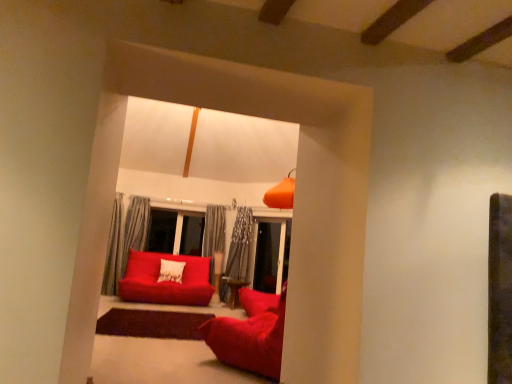
Image resolution: width=512 pixels, height=384 pixels. What do you see at coordinates (166, 281) in the screenshot?
I see `matte red studio couch at center, which appears as the 1th studio couch when viewed from the left` at bounding box center [166, 281].

This screenshot has width=512, height=384. I want to click on matte red studio couch at center, placed as the 2th studio couch when sorted from right to left, so [166, 281].

This screenshot has width=512, height=384. Describe the element at coordinates (250, 334) in the screenshot. I see `velvet red beanbag at center, acting as the first studio couch starting from the front` at that location.

This screenshot has width=512, height=384. What are the coordinates of `velvet red beanbag at center, which ranks as the 2th studio couch in left-to-right order` in the screenshot? It's located at (250, 334).

I want to click on matte red studio couch at center, arranged as the first studio couch when viewed from the back, so click(166, 281).

Is velvet red beanbag at center, acting as the first studio couch starting from the front, to the left or to the right of matte red studio couch at center, placed as the 2th studio couch when sorted from right to left, in the image?

Based on their positions, velvet red beanbag at center, acting as the first studio couch starting from the front, is located to the right of matte red studio couch at center, placed as the 2th studio couch when sorted from right to left.

Considering the positions of objects velvet red beanbag at center, acting as the first studio couch starting from the front, and matte red studio couch at center, the second studio couch viewed from the front, in the image provided, who is behind, velvet red beanbag at center, acting as the first studio couch starting from the front, or matte red studio couch at center, the second studio couch viewed from the front,?

matte red studio couch at center, the second studio couch viewed from the front.

Which is less distant, (237, 341) or (199, 261)?

The point (237, 341) is closer.

Based on the photo, from the image's perspective, relative to matte red studio couch at center, placed as the 2th studio couch when sorted from right to left, is velvet red beanbag at center, arranged as the 1th studio couch when viewed from the right, above or below?

Clearly, from the image's perspective, velvet red beanbag at center, arranged as the 1th studio couch when viewed from the right, is above matte red studio couch at center, placed as the 2th studio couch when sorted from right to left.

From a real-world perspective, is velvet red beanbag at center, acting as the first studio couch starting from the front, over matte red studio couch at center, which appears as the 1th studio couch when viewed from the left?

Incorrect, from a real-world perspective, velvet red beanbag at center, acting as the first studio couch starting from the front, is lower than matte red studio couch at center, which appears as the 1th studio couch when viewed from the left.

Does velvet red beanbag at center, acting as the first studio couch starting from the front, have a lesser width compared to matte red studio couch at center, arranged as the first studio couch when viewed from the back?

Yes, velvet red beanbag at center, acting as the first studio couch starting from the front, is thinner than matte red studio couch at center, arranged as the first studio couch when viewed from the back.

Who is shorter, velvet red beanbag at center, arranged as the 1th studio couch when viewed from the right, or matte red studio couch at center, the second studio couch viewed from the front?

velvet red beanbag at center, arranged as the 1th studio couch when viewed from the right, is shorter.

Can you confirm if velvet red beanbag at center, arranged as the 1th studio couch when viewed from the right, is bigger than matte red studio couch at center, which appears as the 1th studio couch when viewed from the left?

No, velvet red beanbag at center, arranged as the 1th studio couch when viewed from the right, is not bigger than matte red studio couch at center, which appears as the 1th studio couch when viewed from the left.

Can we say velvet red beanbag at center, arranged as the 1th studio couch when viewed from the right, lies outside matte red studio couch at center, placed as the 2th studio couch when sorted from right to left?

That's correct, velvet red beanbag at center, arranged as the 1th studio couch when viewed from the right, is outside of matte red studio couch at center, placed as the 2th studio couch when sorted from right to left.

Is velvet red beanbag at center, acting as the first studio couch starting from the front, not close to matte red studio couch at center, which appears as the 1th studio couch when viewed from the left?

Absolutely, velvet red beanbag at center, acting as the first studio couch starting from the front, is distant from matte red studio couch at center, which appears as the 1th studio couch when viewed from the left.

Is velvet red beanbag at center, acting as the first studio couch starting from the front, turned away from matte red studio couch at center, arranged as the first studio couch when viewed from the back?

No, matte red studio couch at center, arranged as the first studio couch when viewed from the back, is not at the back of velvet red beanbag at center, acting as the first studio couch starting from the front.

You are a GUI agent. You are given a task and a screenshot of the screen. Output one action in this format:
    pyautogui.click(x=<x>, y=<y>)
    Task: Click on the studio couch below the matte red studio couch at center, which appears as the 1th studio couch when viewed from the left (from a real-world perspective)
    This screenshot has width=512, height=384.
    Given the screenshot: What is the action you would take?
    pyautogui.click(x=250, y=334)

Which object is positioned more to the left, matte red studio couch at center, arranged as the first studio couch when viewed from the back, or velvet red beanbag at center, acting as the first studio couch starting from the front?

Positioned to the left is matte red studio couch at center, arranged as the first studio couch when viewed from the back.

Does matte red studio couch at center, arranged as the first studio couch when viewed from the back, lie in front of velvet red beanbag at center, arranged as the 2th studio couch when viewed from the back?

No, the depth of matte red studio couch at center, arranged as the first studio couch when viewed from the back, is greater than that of velvet red beanbag at center, arranged as the 2th studio couch when viewed from the back.

Which is closer, (x=163, y=288) or (x=264, y=349)?

The point (x=264, y=349) is closer to the camera.

From the image's perspective, would you say matte red studio couch at center, placed as the 2th studio couch when sorted from right to left, is shown under velvet red beanbag at center, which ranks as the 2th studio couch in left-to-right order?

Indeed, from the image's perspective, matte red studio couch at center, placed as the 2th studio couch when sorted from right to left, is shown beneath velvet red beanbag at center, which ranks as the 2th studio couch in left-to-right order.

From a real-world perspective, between matte red studio couch at center, placed as the 2th studio couch when sorted from right to left, and velvet red beanbag at center, which ranks as the 2th studio couch in left-to-right order, who is vertically higher?

matte red studio couch at center, placed as the 2th studio couch when sorted from right to left, is physically above.

Can you confirm if matte red studio couch at center, arranged as the first studio couch when viewed from the back, is thinner than velvet red beanbag at center, arranged as the 2th studio couch when viewed from the back?

No.

From the picture: In terms of height, does matte red studio couch at center, which appears as the 1th studio couch when viewed from the left, look taller or shorter compared to velvet red beanbag at center, acting as the first studio couch starting from the front?

Considering their sizes, matte red studio couch at center, which appears as the 1th studio couch when viewed from the left, has more height than velvet red beanbag at center, acting as the first studio couch starting from the front.

In terms of size, does matte red studio couch at center, which appears as the 1th studio couch when viewed from the left, appear bigger or smaller than velvet red beanbag at center, arranged as the 2th studio couch when viewed from the back?

matte red studio couch at center, which appears as the 1th studio couch when viewed from the left, is bigger than velvet red beanbag at center, arranged as the 2th studio couch when viewed from the back.

Is matte red studio couch at center, arranged as the first studio couch when viewed from the back, outside of velvet red beanbag at center, arranged as the 2th studio couch when viewed from the back?

matte red studio couch at center, arranged as the first studio couch when viewed from the back, lies outside velvet red beanbag at center, arranged as the 2th studio couch when viewed from the back,'s area.

Is the surface of matte red studio couch at center, which appears as the 1th studio couch when viewed from the left, in direct contact with velvet red beanbag at center, arranged as the 2th studio couch when viewed from the back?

matte red studio couch at center, which appears as the 1th studio couch when viewed from the left, is not next to velvet red beanbag at center, arranged as the 2th studio couch when viewed from the back, and they're not touching.

Could you tell me if matte red studio couch at center, the second studio couch viewed from the front, is turned towards velvet red beanbag at center, arranged as the 1th studio couch when viewed from the right?

Yes, matte red studio couch at center, the second studio couch viewed from the front, faces towards velvet red beanbag at center, arranged as the 1th studio couch when viewed from the right.

Where is `studio couch above the matte red studio couch at center, the second studio couch viewed from the front (from the image's perspective)`? This screenshot has height=384, width=512. studio couch above the matte red studio couch at center, the second studio couch viewed from the front (from the image's perspective) is located at coordinates (250, 334).

This screenshot has height=384, width=512. I want to click on studio couch that appears above the velvet red beanbag at center, acting as the first studio couch starting from the front (from a real-world perspective), so click(166, 281).

Find the location of a particular element. This screenshot has height=384, width=512. studio couch below the velvet red beanbag at center, which ranks as the 2th studio couch in left-to-right order (from the image's perspective) is located at coordinates (166, 281).